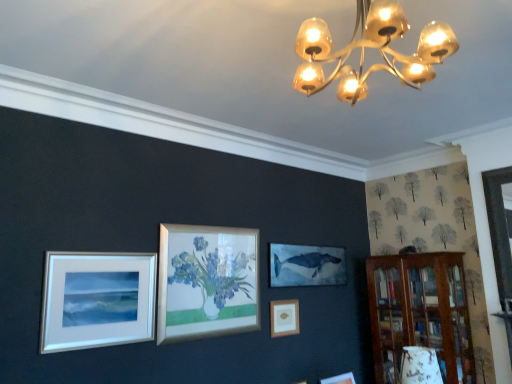
Question: Choose the correct answer: Is metallic gold chandelier at upper center inside wooden frame at center, the first picture frame viewed from the back, or outside it?

Choices:
 (A) outside
 (B) inside

Answer: (A)

Question: Considering the positions of metallic gold chandelier at upper center and wooden frame at center, the 1th picture frame from the bottom, in the image, is metallic gold chandelier at upper center taller or shorter than wooden frame at center, the 1th picture frame from the bottom,?

Choices:
 (A) short
 (B) tall

Answer: (B)

Question: Which of these objects is positioned farthest from the white matte picture frame at lower left, which is the 1th picture frame from top to bottom?

Choices:
 (A) metallic gold chandelier at upper center
 (B) wooden frame at center, the 1th picture frame from the bottom
 (C) wooden bookshelf at right

Answer: (C)

Question: Which is nearer to the metallic gold chandelier at upper center?

Choices:
 (A) wooden bookshelf at right
 (B) white matte picture frame at lower left, the 2th picture frame from the right
 (C) wooden frame at center, the 2th picture frame viewed from the left

Answer: (B)